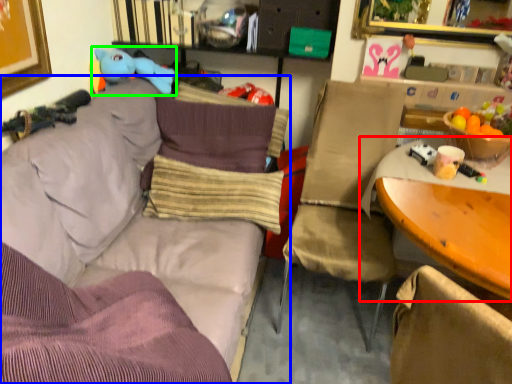
Question: Which is farther away from table (highlighted by a red box)? studio couch (highlighted by a blue box) or toy (highlighted by a green box)?

Choices:
 (A) studio couch
 (B) toy

Answer: (B)